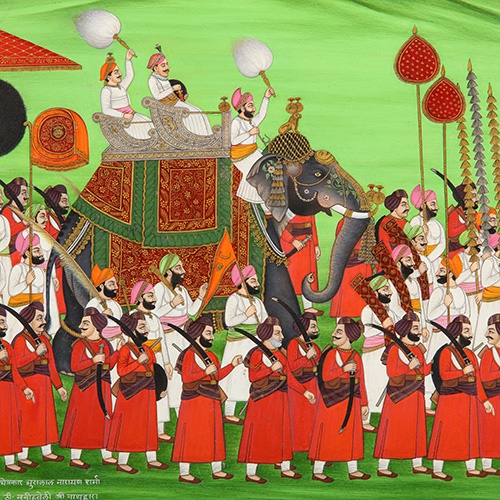
At what (x,y) coordinates should I click in order to perform the action: click on white fans. Please return your answer as a coordinate pair (x, y). Looking at the image, I should click on (249, 58), (97, 33).